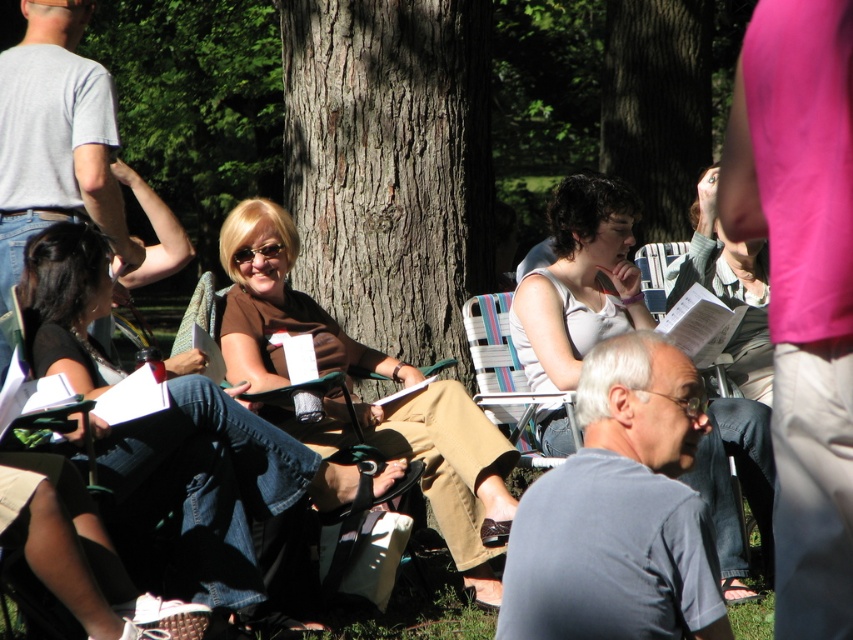
You are a photographer standing 10 feet away from the group. You want to take a photo that includes both the matte brown shirt at center and the white matte tank top at center without any distortion. What is the minimum distance you should maintain from the group?

The minimum distance you should maintain from the group is 10 feet plus the distance between the two subjects. Since the matte brown shirt at center and white matte tank top at center are 4.80 feet apart, you should stay at least 14.8 feet away to ensure both fit clearly in the frame without distortion.

You are a photographer standing at the edge of the park. You want to take a photo that includes both the matte brown shirt at center and the smooth bark tree at center. Which object will appear smaller in the photo?

The matte brown shirt at center will appear smaller in the photo because it has a lesser height compared to the smooth bark tree at center.

You are a photographer trying to capture a clear photo of the matte brown shirt at center without the white matte tank top at center blocking it. Based on their positions, is this possible?

Yes, since the matte brown shirt at center is in front of the white matte tank top at center, you can capture a clear photo of the matte brown shirt at center without obstruction from the white matte tank top at center.